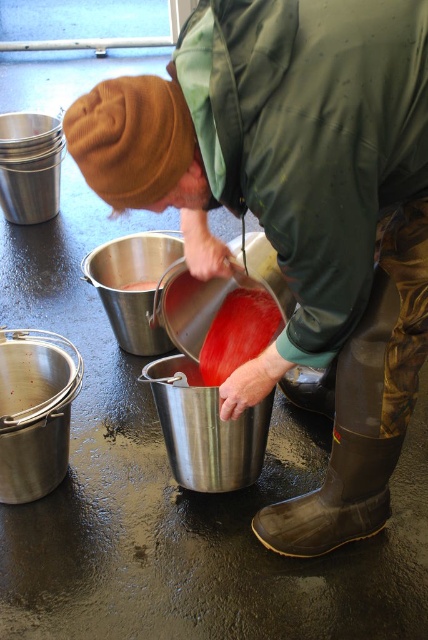
Question: From the image, what is the correct spatial relationship of metallic bucket at center in relation to bright red smooth liquid at center?

Choices:
 (A) left
 (B) right

Answer: (B)

Question: Is bright red smooth liquid at center above matte red liquid at center?

Choices:
 (A) yes
 (B) no

Answer: (B)

Question: Which point appears closest to the camera in this image?

Choices:
 (A) (234, 316)
 (B) (354, 444)
 (C) (133, 289)

Answer: (B)

Question: Can you confirm if black rubber boot at lower right is thinner than matte red liquid at center?

Choices:
 (A) yes
 (B) no

Answer: (B)

Question: Which of the following is the closest to the observer?

Choices:
 (A) matte red liquid at center
 (B) metallic bucket at center

Answer: (B)

Question: Which object appears farthest from the camera in this image?

Choices:
 (A) matte red liquid at center
 (B) metallic bucket at center
 (C) bright red smooth liquid at center

Answer: (A)